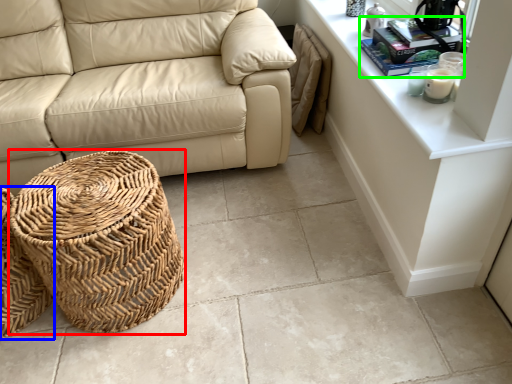
Question: Which object is the closest to the basket (highlighted by a red box)? Choose among these: basket (highlighted by a blue box) or book (highlighted by a green box).

Choices:
 (A) basket
 (B) book

Answer: (A)